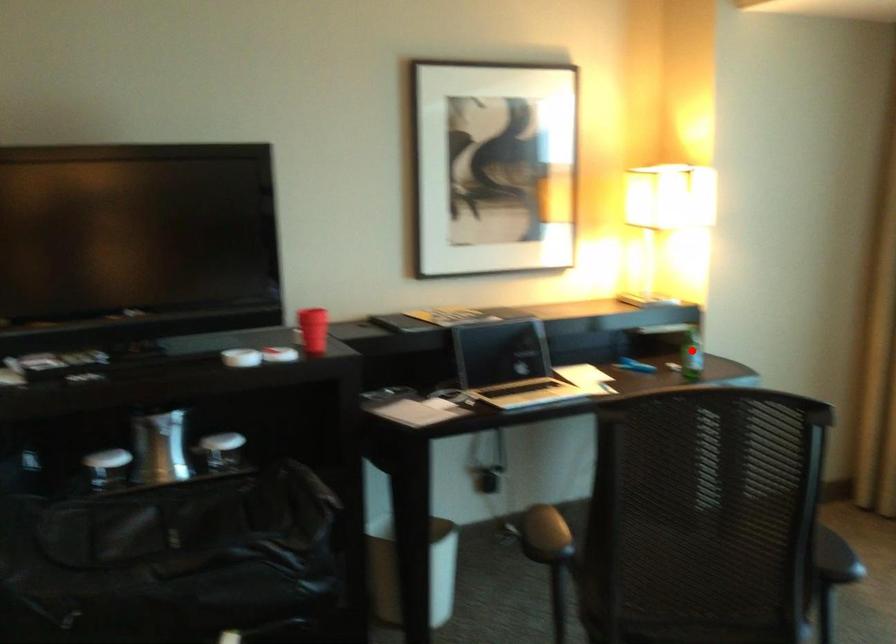
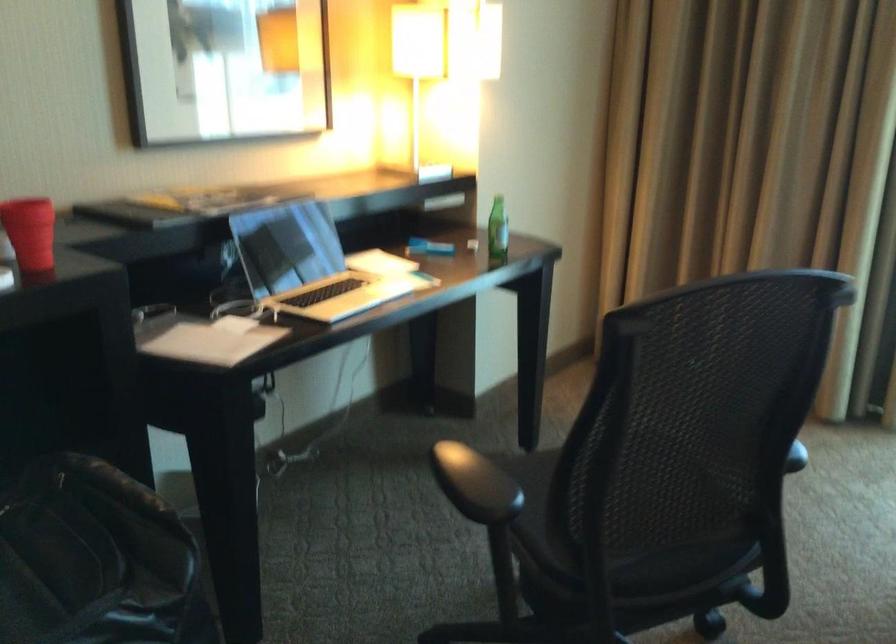
Question: I am providing you with two images of the same scene from different viewpoints. A red point is shown in image1. For the corresponding object point in image2, is it positioned nearer or farther from the camera?

Choices:
 (A) Nearer
 (B) Farther

Answer: (A)